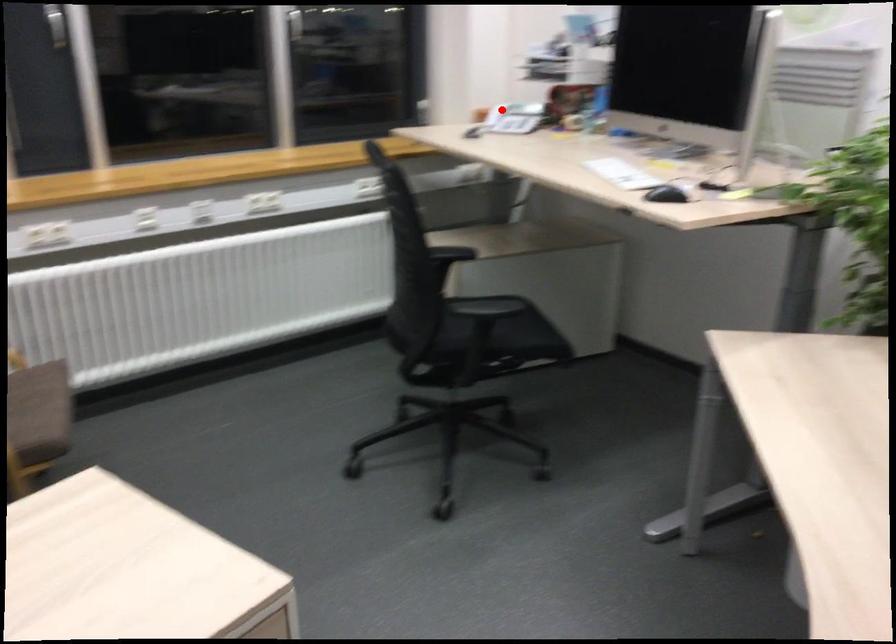
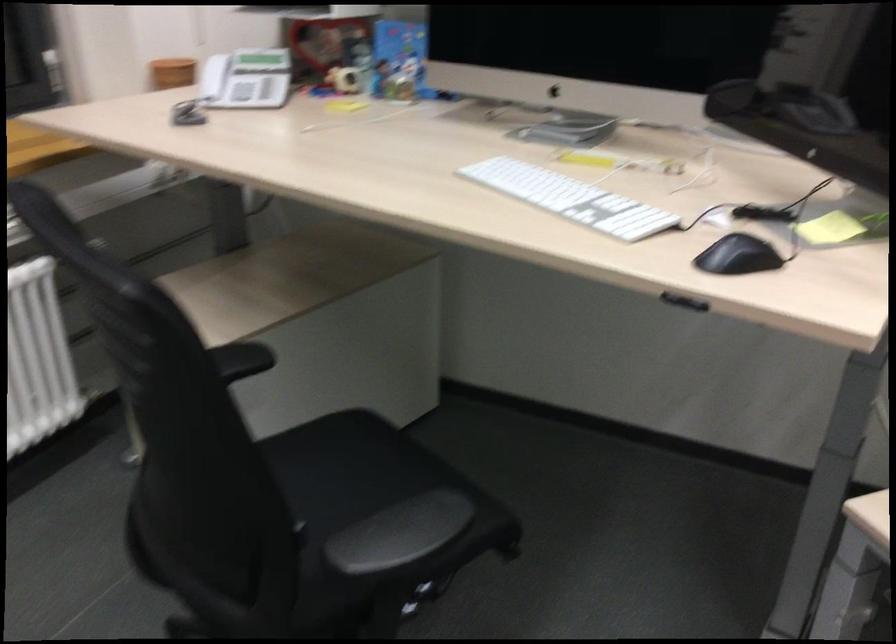
Question: I am providing you with two images of the same scene from different viewpoints. Image1 has a red point marked. In image2, the corresponding 3D location appears at what relative position? Reply with the corresponding letter.

Choices:
 (A) Closer
 (B) Farther

Answer: (A)